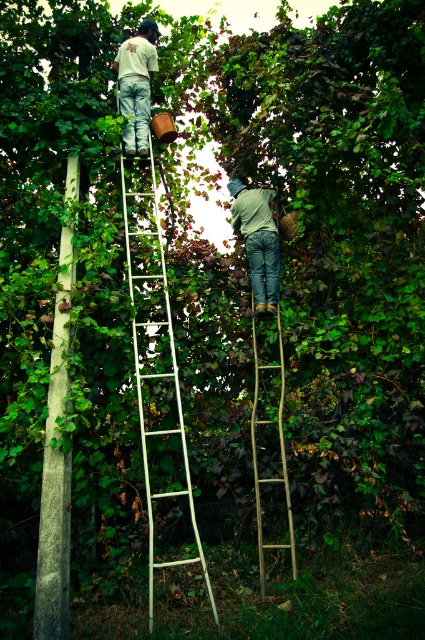
Based on the coordinates provided, which object corresponds to the point at (56, 468)?

The gray concrete pole at left corresponds to the point at (56, 468).

You are a worker in the vineyard and need to reach the grapes at point (153, 340). Which ladder should you use?

The white metal ladder at center is located at point (153, 340), so you should use the white metal ladder at center to reach the grapes there.